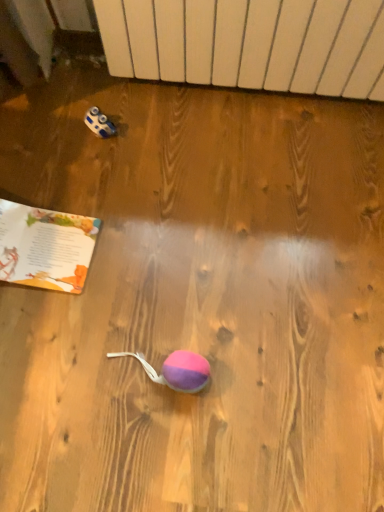
Question: Based on their positions, is paperback book at bottom left located to the left or right of white matte radiator at upper center?

Choices:
 (A) right
 (B) left

Answer: (B)

Question: Is paperback book at bottom left taller or shorter than white matte radiator at upper center?

Choices:
 (A) short
 (B) tall

Answer: (A)

Question: From a real-world perspective, is paperback book at bottom left physically located above or below white matte radiator at upper center?

Choices:
 (A) below
 (B) above

Answer: (A)

Question: From the image's perspective, is white matte radiator at upper center located above or below paperback book at bottom left?

Choices:
 (A) below
 (B) above

Answer: (B)

Question: From a real-world perspective, is white matte radiator at upper center positioned above or below paperback book at bottom left?

Choices:
 (A) below
 (B) above

Answer: (B)

Question: Would you say white matte radiator at upper center is to the left or to the right of paperback book at bottom left in the picture?

Choices:
 (A) left
 (B) right

Answer: (B)

Question: Considering the positions of point pyautogui.click(x=203, y=49) and point pyautogui.click(x=33, y=211), is point pyautogui.click(x=203, y=49) closer or farther from the camera than point pyautogui.click(x=33, y=211)?

Choices:
 (A) farther
 (B) closer

Answer: (A)